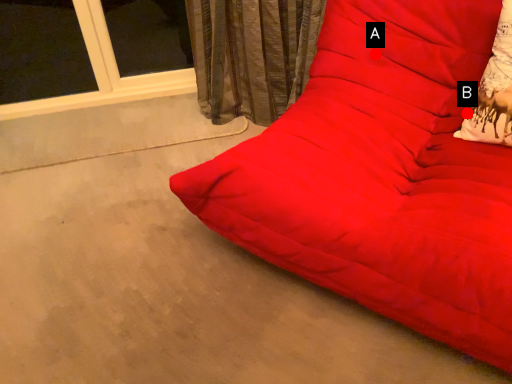
Question: Two points are circled on the image, labeled by A and B beside each circle. Which point is further to the camera?

Choices:
 (A) A is further
 (B) B is further

Answer: (A)